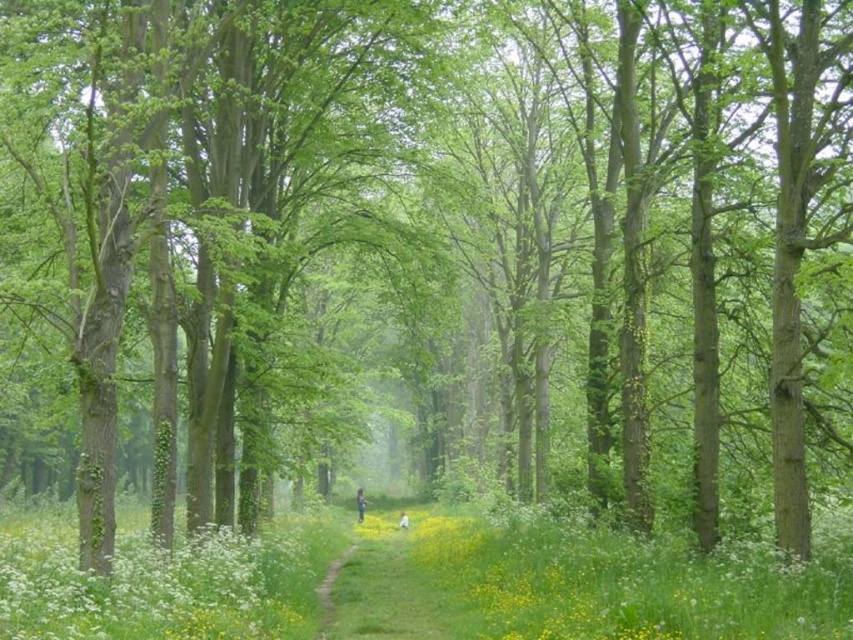
You are standing on the dirt path in the forest and want to step onto the green soft grass at lower center. What are the coordinates of the grass you need to step on?

The coordinates of the green soft grass at lower center are at point (416, 580).

You are standing at the point marked by the coordinates point (416, 580) in the forest scene. What is the terrain like at that location?

The terrain at point (416, 580) is green soft grass at lower center.